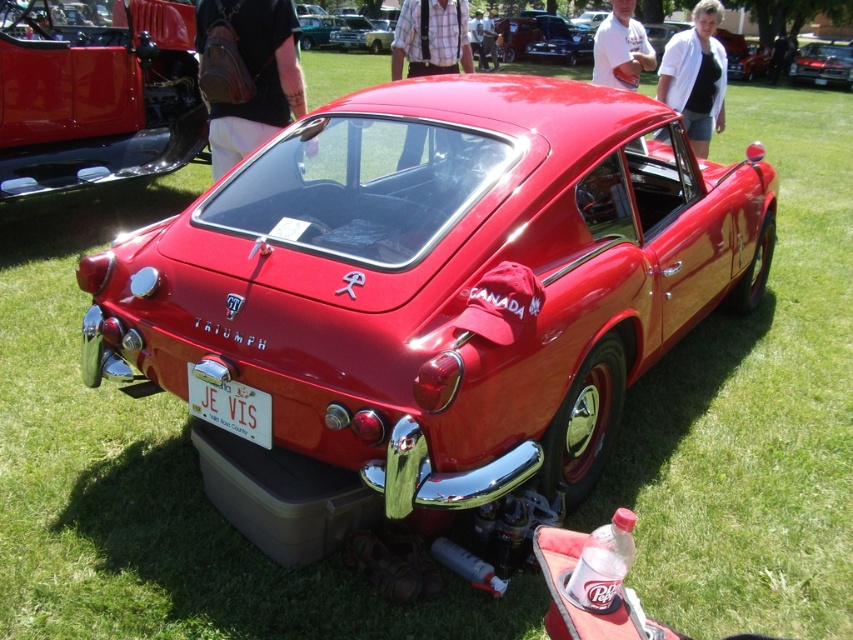
Question: Considering the real-world distances, which object is closest to the glossy red car at upper right?

Choices:
 (A) shiny metallic car at center
 (B) white plastic license plate at center
 (C) matte red car at upper left
 (D) glossy red car at center

Answer: (A)

Question: Observing the image, what is the correct spatial positioning of matte red car at upper left in reference to white plastic license plate at center?

Choices:
 (A) above
 (B) below

Answer: (A)

Question: Does white plastic license plate at center have a greater width compared to shiny metallic car at center?

Choices:
 (A) no
 (B) yes

Answer: (A)

Question: Is shiny metallic car at center further to camera compared to glossy red car at center?

Choices:
 (A) yes
 (B) no

Answer: (A)

Question: Which point is farther to the camera?

Choices:
 (A) shiny metallic car at center
 (B) white plastic license plate at center
 (C) glossy red car at upper right

Answer: (A)

Question: Based on their relative distances, which object is farther from the shiny metallic car at center?

Choices:
 (A) white plastic license plate at center
 (B) glossy red car at upper right

Answer: (A)